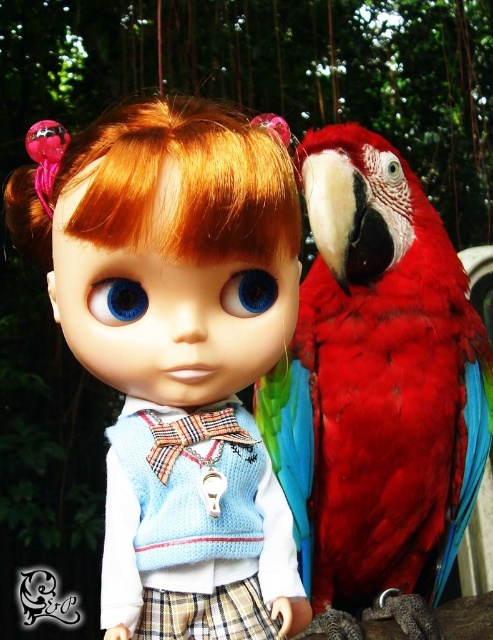
Question: Can you confirm if matte blue knitted vest at center is bigger than shiny red parrot at right?

Choices:
 (A) yes
 (B) no

Answer: (B)

Question: Which object appears closest to the camera in this image?

Choices:
 (A) matte blue knitted vest at center
 (B) shiny red parrot at right

Answer: (A)

Question: Is matte blue knitted vest at center behind shiny red parrot at right?

Choices:
 (A) no
 (B) yes

Answer: (A)

Question: From the image, what is the correct spatial relationship of matte blue knitted vest at center in relation to shiny red parrot at right?

Choices:
 (A) right
 (B) left

Answer: (B)

Question: Which point is closer to the camera?

Choices:
 (A) shiny red parrot at right
 (B) matte blue knitted vest at center

Answer: (B)